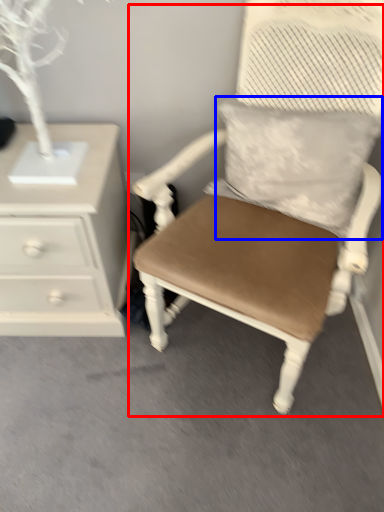
Question: Which object appears closest to the camera in this image, chair (highlighted by a red box) or pillow (highlighted by a blue box)?

Choices:
 (A) chair
 (B) pillow

Answer: (A)